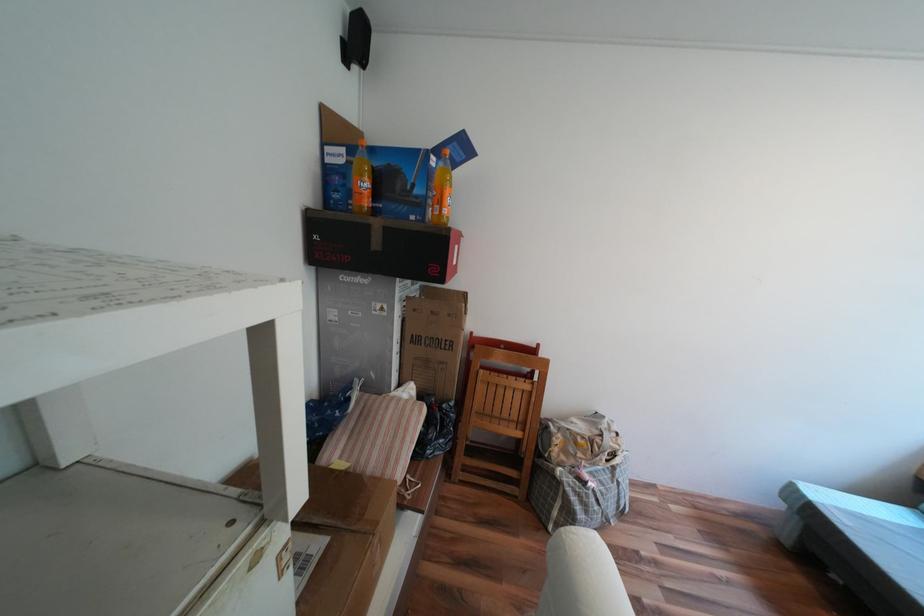
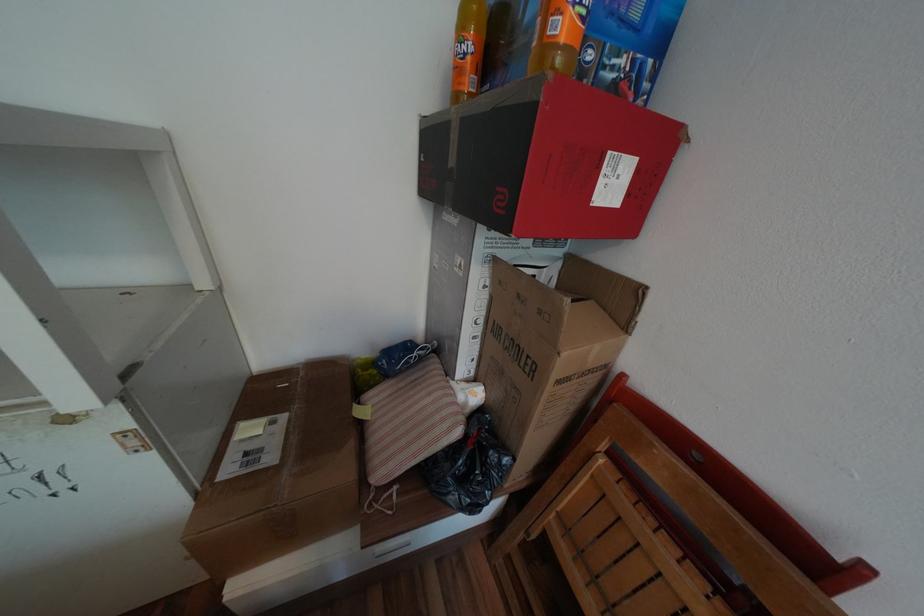
Locate, in the second image, the point that corresponds to pixel 454 406 in the first image.

(500, 453)